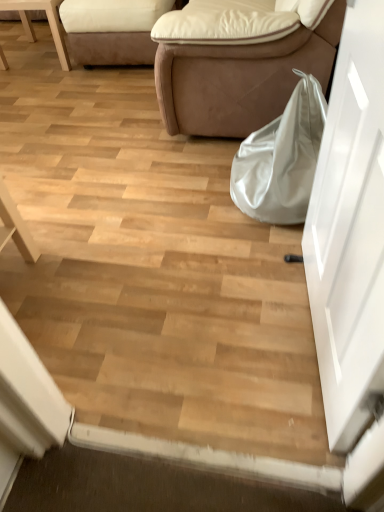
Identify the location of vacant space that's between white glossy door at right and satin white bag at lower right. Image resolution: width=384 pixels, height=512 pixels. (270, 288).